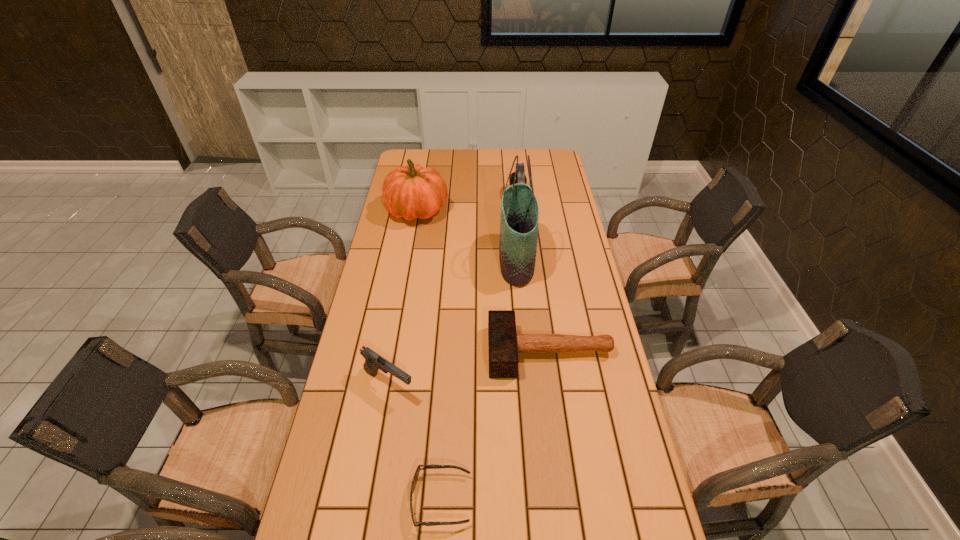
You are a GUI agent. You are given a task and a screenshot of the screen. Output one action in this format:
    pyautogui.click(x=<x>, y=<y>)
    Task: Click on the third farthest object
    The image size is (960, 540).
    Given the screenshot: What is the action you would take?
    pyautogui.click(x=519, y=218)

Where is `the tallest object`? the tallest object is located at coordinates (519, 218).

Image resolution: width=960 pixels, height=540 pixels. I want to click on pumpkin, so click(x=412, y=191).

You are a GUI agent. You are given a task and a screenshot of the screen. Output one action in this format:
    pyautogui.click(x=<x>, y=<y>)
    Task: Click on the fourth shortest object
    Image resolution: width=960 pixels, height=540 pixels.
    Given the screenshot: What is the action you would take?
    pos(520,176)

Image resolution: width=960 pixels, height=540 pixels. I want to click on gun, so click(x=373, y=362).

Locate an element on the screen. mallet is located at coordinates (504, 344).

What are the coordinates of `sunglasses` in the screenshot? It's located at (432, 466).

Locate an element on the screen. This screenshot has height=540, width=960. the shortest object is located at coordinates (432, 466).

What are the coordinates of `free region located on the front of the tallest object` in the screenshot? It's located at pos(526,363).

Where is `vacant region located 0.370m on the back of the fifth shortest object`? This screenshot has height=540, width=960. vacant region located 0.370m on the back of the fifth shortest object is located at coordinates (427, 152).